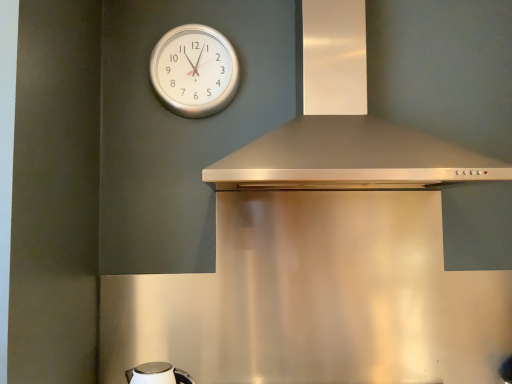
Question: Would you say white glossy kettle at lower left is to the left or to the right of satin silver vent at upper center in the picture?

Choices:
 (A) left
 (B) right

Answer: (A)

Question: Is white glossy kettle at lower left in front of or behind satin silver vent at upper center in the image?

Choices:
 (A) behind
 (B) front

Answer: (A)

Question: Considering the real-world distances, which object is farthest from the silver metallic clock at upper center?

Choices:
 (A) satin silver vent at upper center
 (B) white glossy kettle at lower left

Answer: (B)

Question: Which object is positioned farthest from the silver metallic clock at upper center?

Choices:
 (A) white glossy kettle at lower left
 (B) satin silver vent at upper center

Answer: (A)